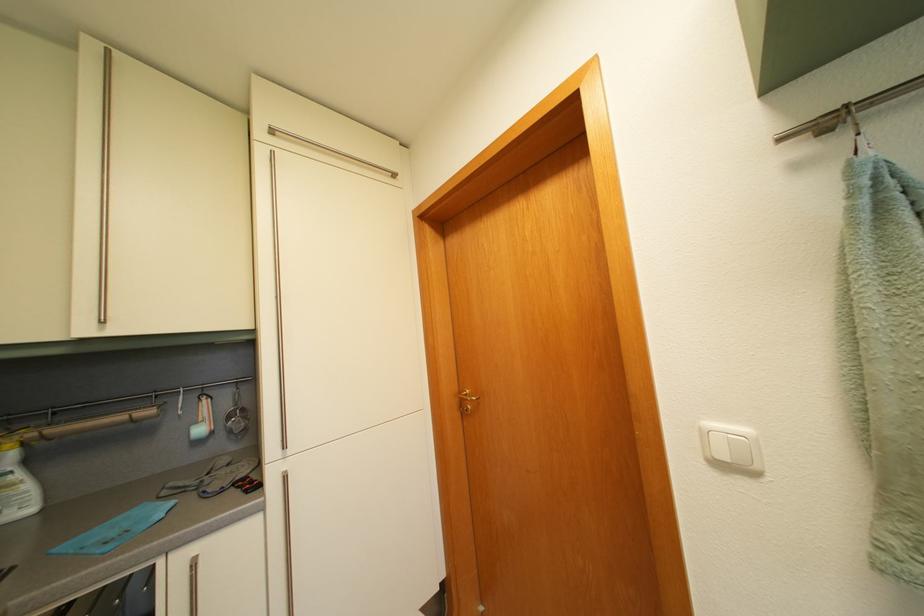
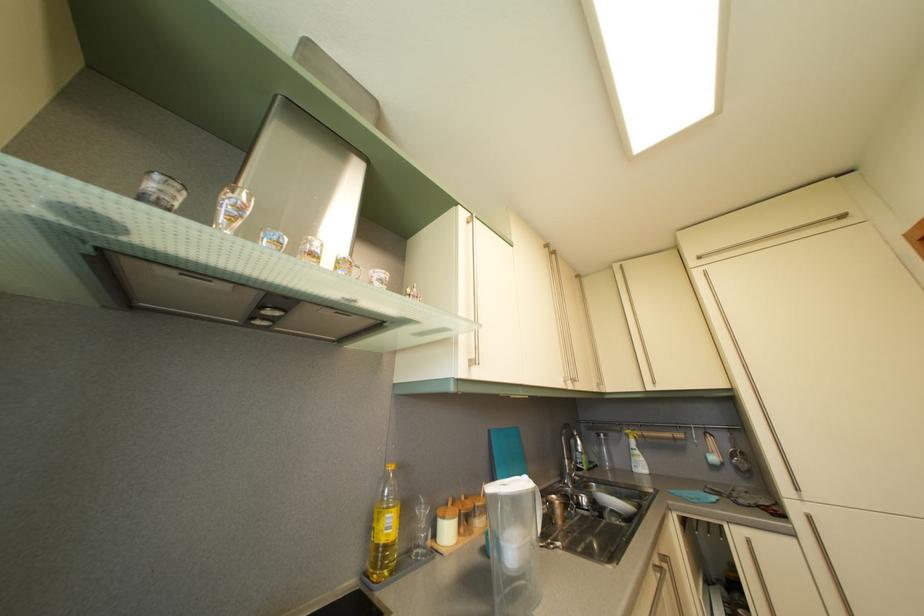
Find the pixel in the second image that matches (238,439) in the first image.

(746, 476)